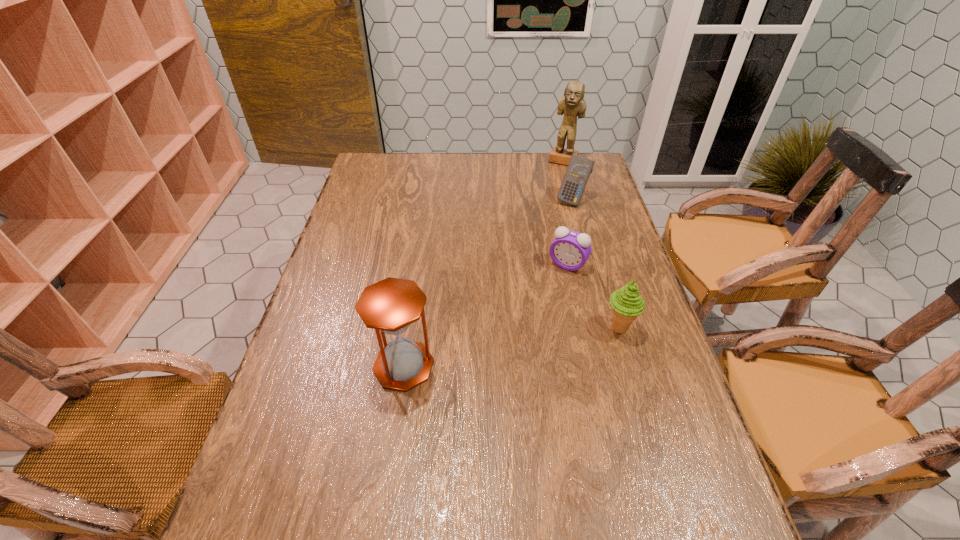
Locate an element on the screen. This screenshot has height=540, width=960. hourglass is located at coordinates (391, 305).

The image size is (960, 540). What are the coordinates of `the leftmost object` in the screenshot? It's located at (391, 305).

At what (x,y) coordinates should I click in order to perform the action: click on icecream. Please return your answer as a coordinate pair (x, y). Looking at the image, I should click on (627, 304).

Locate an element on the screen. The image size is (960, 540). calculator is located at coordinates (579, 168).

The image size is (960, 540). I want to click on the farthest object, so click(x=572, y=104).

This screenshot has height=540, width=960. Identify the location of figurine. (572, 104).

Find the location of `the third farthest object`. the third farthest object is located at coordinates (570, 250).

The width and height of the screenshot is (960, 540). I want to click on alarm clock, so click(570, 250).

Find the location of a particular element. This screenshot has width=960, height=540. vacant region located on the right of the leftmost object is located at coordinates (559, 366).

At what (x,y) coordinates should I click in order to perform the action: click on free space located 0.050m on the left of the second nearest object. Please return your answer as a coordinate pair (x, y). Looking at the image, I should click on pyautogui.click(x=584, y=328).